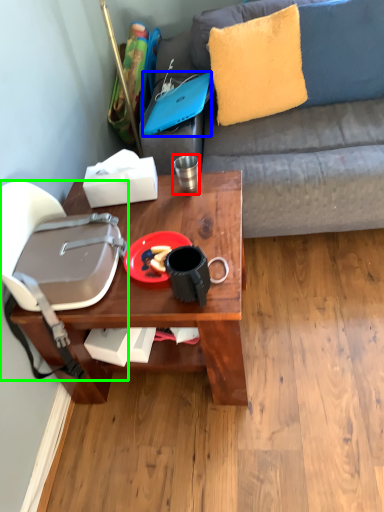
Question: Which is farther away from coffee cup (highlighted by a red box)? laptop (highlighted by a blue box) or handbag (highlighted by a green box)?

Choices:
 (A) laptop
 (B) handbag

Answer: (B)